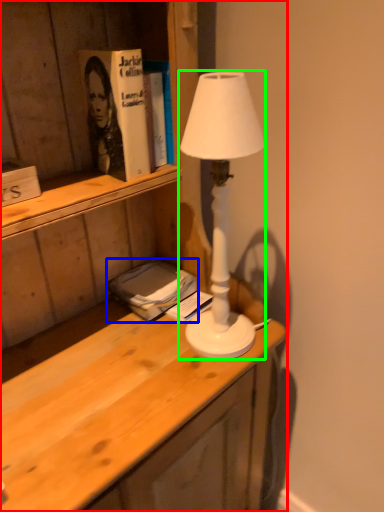
Question: Which object is the farthest from desk (highlighted by a red box)? Choose among these: book (highlighted by a blue box) or lamp (highlighted by a green box).

Choices:
 (A) book
 (B) lamp

Answer: (A)